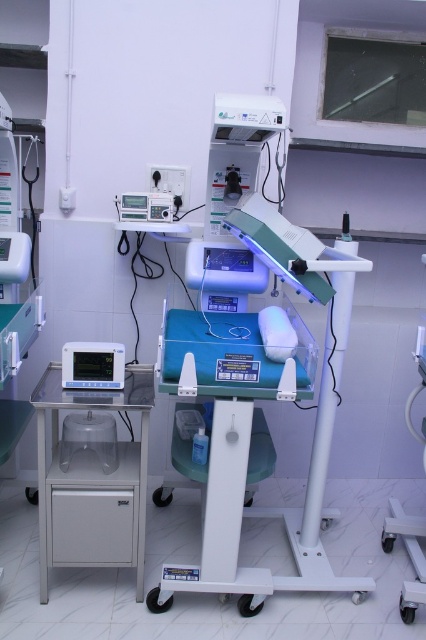
You are a nurse in a hospital room and need to access the blue plastic tray at center and the metallic gray monitor at left. Which object is closer to you when you are standing in front of the cart?

The blue plastic tray at center is closer to you because it is in front of the metallic gray monitor at left.

You are a nurse who needs to adjust the settings on both the metallic gray monitor at left and the matte black monitor at left. If your arm can reach 10 inches, can you adjust both monitors without moving your position?

The metallic gray monitor at left is 10.07 inches away from the matte black monitor at left. Since the distance between them is slightly more than 10 inches, you cannot adjust both monitors without moving your position.